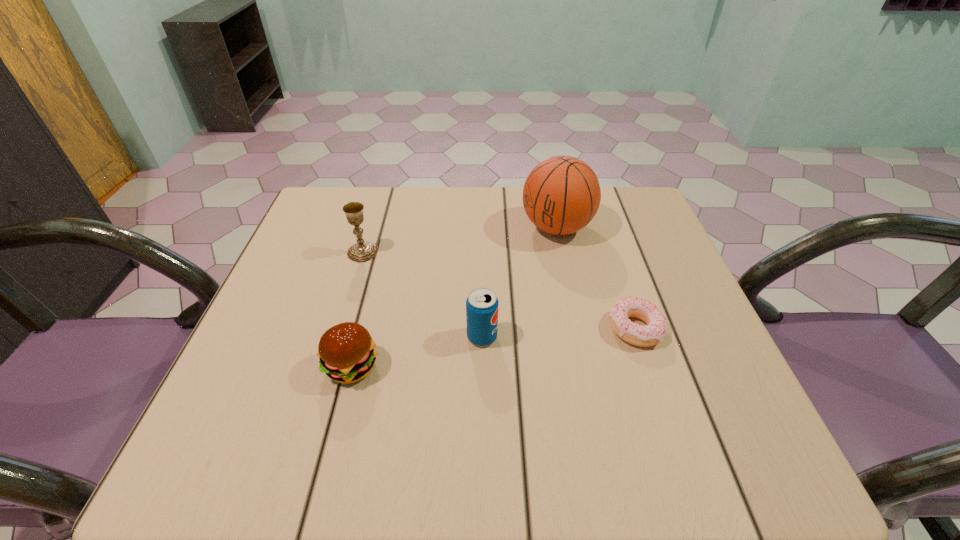
Identify the location of vacant space that is in between the soda can and the basketball. (519, 282).

This screenshot has height=540, width=960. In order to click on blank region between the tallest object and the hamburger in this screenshot , I will do `click(454, 297)`.

You are a GUI agent. You are given a task and a screenshot of the screen. Output one action in this format:
    pyautogui.click(x=<x>, y=<y>)
    Task: Click on the unoccupied position between the basketball and the second shortest object
    The width and height of the screenshot is (960, 540).
    Given the screenshot: What is the action you would take?
    (x=454, y=297)

I want to click on unoccupied position between the soda can and the shortest object, so click(x=559, y=333).

The height and width of the screenshot is (540, 960). Identify the location of empty location between the chalice and the shortest object. (499, 291).

Locate an element on the screen. empty space between the basketball and the hamburger is located at coordinates (454, 297).

Identify the location of free space that is in between the tallest object and the hamburger. Image resolution: width=960 pixels, height=540 pixels. (454, 297).

Image resolution: width=960 pixels, height=540 pixels. I want to click on vacant area between the soda can and the doughnut, so click(559, 333).

Locate which object ranks second in proximity to the chalice. Please provide its 2D coordinates. Your answer should be formatted as a tuple, i.e. [(x, y)], where the tuple contains the x and y coordinates of a point satisfying the conditions above.

[(482, 304)]

Identify the location of object that is the third closest to the soda can. 561,195.